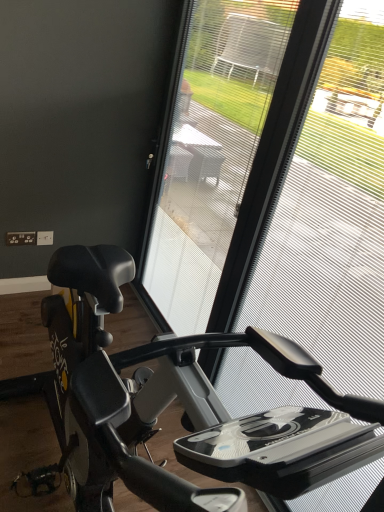
Question: Is black matte stationary bicycle at center placed right next to transparent plastic screen door at center?

Choices:
 (A) no
 (B) yes

Answer: (A)

Question: Is transparent plastic screen door at center a part of black matte stationary bicycle at center?

Choices:
 (A) no
 (B) yes

Answer: (A)

Question: Does black matte stationary bicycle at center come behind transparent plastic screen door at center?

Choices:
 (A) yes
 (B) no

Answer: (B)

Question: Is black matte stationary bicycle at center positioned with its back to transparent plastic screen door at center?

Choices:
 (A) no
 (B) yes

Answer: (B)

Question: Can you confirm if black matte stationary bicycle at center is smaller than transparent plastic screen door at center?

Choices:
 (A) no
 (B) yes

Answer: (A)

Question: In the image, is transparent mesh at center positioned in front of or behind transparent plastic screen door at center?

Choices:
 (A) behind
 (B) front

Answer: (B)

Question: In terms of width, does transparent mesh at center look wider or thinner when compared to transparent plastic screen door at center?

Choices:
 (A) thin
 (B) wide

Answer: (A)

Question: Based on their sizes in the image, would you say transparent mesh at center is bigger or smaller than transparent plastic screen door at center?

Choices:
 (A) small
 (B) big

Answer: (A)

Question: From a real-world perspective, is transparent mesh at center physically located above or below transparent plastic screen door at center?

Choices:
 (A) above
 (B) below

Answer: (A)

Question: Considering the positions of black matte stationary bicycle at center and transparent plastic screen door at center in the image, is black matte stationary bicycle at center taller or shorter than transparent plastic screen door at center?

Choices:
 (A) short
 (B) tall

Answer: (A)

Question: Is point (64, 323) closer or farther from the camera than point (271, 53)?

Choices:
 (A) farther
 (B) closer

Answer: (B)

Question: From a real-world perspective, is black matte stationary bicycle at center positioned above or below transparent plastic screen door at center?

Choices:
 (A) below
 (B) above

Answer: (A)

Question: From the image's perspective, is black matte stationary bicycle at center located above or below transparent plastic screen door at center?

Choices:
 (A) below
 (B) above

Answer: (A)

Question: Is transparent plastic screen door at center bigger or smaller than transparent mesh at center?

Choices:
 (A) big
 (B) small

Answer: (A)

Question: Is transparent plastic screen door at center wider or thinner than transparent mesh at center?

Choices:
 (A) wide
 (B) thin

Answer: (A)